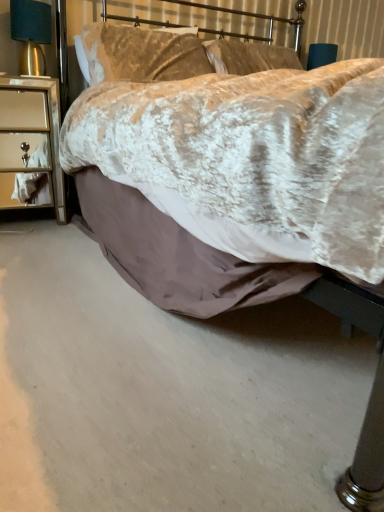
What is the approximate width of velvet beige pillow at upper center?

velvet beige pillow at upper center is 11.54 inches wide.

Measure the distance between velvet beige pillow at upper center and camera.

velvet beige pillow at upper center and camera are 5.58 feet apart.

This screenshot has height=512, width=384. I want to click on silver mirrored nightstand at left, so click(x=30, y=141).

Looking at this image, can you confirm if satin gold lampshade at left is bigger than silver mirrored nightstand at left?

No, satin gold lampshade at left is not bigger than silver mirrored nightstand at left.

Which object is further away from the camera taking this photo, satin gold lampshade at left or silver mirrored nightstand at left?

satin gold lampshade at left is more distant.

Is satin gold lampshade at left at the left side of silver mirrored nightstand at left?

Incorrect, satin gold lampshade at left is not on the left side of silver mirrored nightstand at left.

Find the location of `nightstand in front of the satin gold lampshade at left`. nightstand in front of the satin gold lampshade at left is located at coordinates (30, 141).

Would you say satin gold lampshade at left is a long distance from velvet beige pillow at upper center?

satin gold lampshade at left is actually quite close to velvet beige pillow at upper center.

Relative to velvet beige pillow at upper center, is satin gold lampshade at left in front or behind?

satin gold lampshade at left is positioned farther from the viewer than velvet beige pillow at upper center.

How different are the orientations of satin gold lampshade at left and velvet beige pillow at upper center in degrees?

The facing directions of satin gold lampshade at left and velvet beige pillow at upper center are 0.001 degrees apart.

Considering their positions, is silver mirrored nightstand at left located in front of or behind velvet beige pillow at upper center?

Clearly, silver mirrored nightstand at left is in front of velvet beige pillow at upper center.

Do you think silver mirrored nightstand at left is within velvet beige pillow at upper center, or outside of it?

silver mirrored nightstand at left is not enclosed by velvet beige pillow at upper center.

Can you tell me how much silver mirrored nightstand at left and velvet beige pillow at upper center differ in facing direction?

0.000323 degrees separate the facing orientations of silver mirrored nightstand at left and velvet beige pillow at upper center.

This screenshot has width=384, height=512. What are the coordinates of `pillow to the right of silver mirrored nightstand at left` in the screenshot? It's located at (138, 54).

In the scene shown: How different are the orientations of velvet beige pillow at upper center and silver mirrored nightstand at left in degrees?

The angular difference between velvet beige pillow at upper center and silver mirrored nightstand at left is 0.000323 degrees.

Is velvet beige pillow at upper center smaller than silver mirrored nightstand at left?

Incorrect, velvet beige pillow at upper center is not smaller in size than silver mirrored nightstand at left.

From the image's perspective, which is below, velvet beige pillow at upper center or silver mirrored nightstand at left?

silver mirrored nightstand at left appears lower in the image.

Can you confirm if velvet beige pillow at upper center is taller than silver mirrored nightstand at left?

Incorrect, the height of velvet beige pillow at upper center is not larger of that of silver mirrored nightstand at left.

From a real-world perspective, who is located lower, silver mirrored nightstand at left or satin gold lampshade at left?

In real-world perspective, silver mirrored nightstand at left is lower.

Between silver mirrored nightstand at left and satin gold lampshade at left, which one has less height?

satin gold lampshade at left is shorter.

Based on the photo, considering their positions, is silver mirrored nightstand at left located in front of or behind satin gold lampshade at left?

Visually, silver mirrored nightstand at left is located in front of satin gold lampshade at left.

Is silver mirrored nightstand at left far from satin gold lampshade at left?

silver mirrored nightstand at left is actually quite close to satin gold lampshade at left.

Is velvet beige pillow at upper center positioned with its back to satin gold lampshade at left?

No, velvet beige pillow at upper center's orientation is not away from satin gold lampshade at left.

Image resolution: width=384 pixels, height=512 pixels. Identify the location of bedside lamp behind the velvet beige pillow at upper center. (31, 34).

Considering the relative positions of velvet beige pillow at upper center and satin gold lampshade at left in the image provided, is velvet beige pillow at upper center to the right of satin gold lampshade at left from the viewer's perspective?

Correct, you'll find velvet beige pillow at upper center to the right of satin gold lampshade at left.

From the image's perspective, is velvet beige pillow at upper center located above satin gold lampshade at left?

Yes, from the image's perspective, velvet beige pillow at upper center is over satin gold lampshade at left.

At what (x,y) coordinates should I click in order to perform the action: click on nightstand lying in front of the satin gold lampshade at left. Please return your answer as a coordinate pair (x, y). The height and width of the screenshot is (512, 384). Looking at the image, I should click on (30, 141).

Locate an element on the screen. The image size is (384, 512). pillow on the right of satin gold lampshade at left is located at coordinates (138, 54).

Looking at the image, which one is located closer to satin gold lampshade at left, velvet beige pillow at upper center or silver mirrored nightstand at left?

silver mirrored nightstand at left.

When comparing their distances from velvet beige pillow at upper center, does silver mirrored nightstand at left or satin gold lampshade at left seem closer?

Based on the image, satin gold lampshade at left appears to be nearer to velvet beige pillow at upper center.

Consider the image. Considering their positions, is satin gold lampshade at left positioned closer to silver mirrored nightstand at left than velvet beige pillow at upper center?

satin gold lampshade at left lies closer to silver mirrored nightstand at left than the other object.

Considering their positions, is satin gold lampshade at left positioned closer to velvet beige pillow at upper center than silver mirrored nightstand at left?

satin gold lampshade at left.

From the image, which object appears to be nearer to silver mirrored nightstand at left, velvet beige pillow at upper center or satin gold lampshade at left?

Based on the image, satin gold lampshade at left appears to be nearer to silver mirrored nightstand at left.

Which object lies further to the anchor point satin gold lampshade at left, silver mirrored nightstand at left or velvet beige pillow at upper center?

velvet beige pillow at upper center lies further to satin gold lampshade at left than the other object.

Identify the location of bedside lamp between velvet beige pillow at upper center and silver mirrored nightstand at left in the up-down direction. The image size is (384, 512). (31, 34).